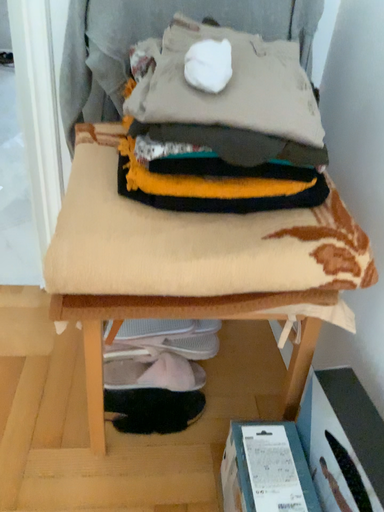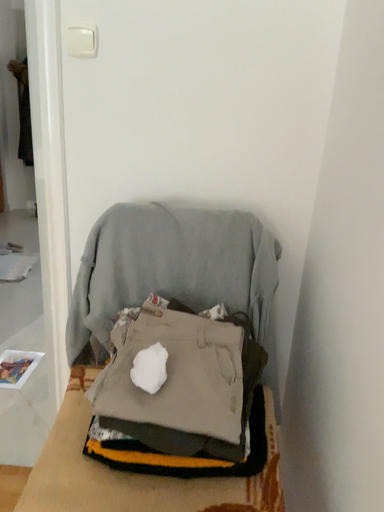
Question: How did the camera likely rotate when shooting the video?

Choices:
 (A) rotated left
 (B) rotated right

Answer: (A)